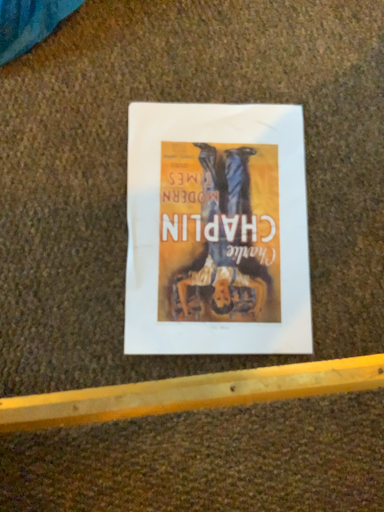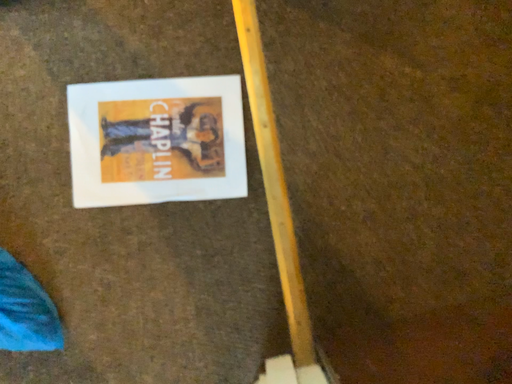
Question: How did the camera likely rotate when shooting the video?

Choices:
 (A) rotated left
 (B) rotated right

Answer: (B)